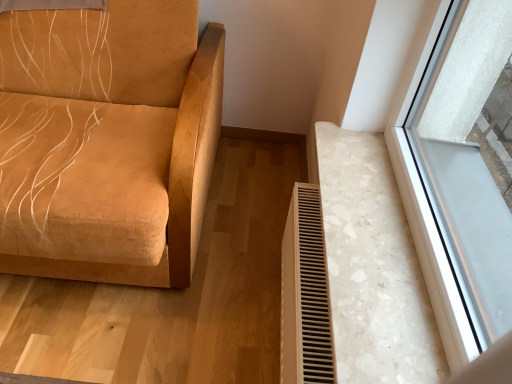
Question: Is white textured radiator at lower right situated inside suede-like tan sofa at left or outside?

Choices:
 (A) outside
 (B) inside

Answer: (A)

Question: Is white textured radiator at lower right in front of or behind suede-like tan sofa at left in the image?

Choices:
 (A) front
 (B) behind

Answer: (B)

Question: Considering the positions of white textured radiator at lower right and suede-like tan sofa at left in the image, is white textured radiator at lower right taller or shorter than suede-like tan sofa at left?

Choices:
 (A) short
 (B) tall

Answer: (A)

Question: Is suede-like tan sofa at left wider or thinner than white textured radiator at lower right?

Choices:
 (A) wide
 (B) thin

Answer: (A)

Question: Visually, is suede-like tan sofa at left positioned to the left or to the right of white textured radiator at lower right?

Choices:
 (A) right
 (B) left

Answer: (B)

Question: In the image, is suede-like tan sofa at left positioned in front of or behind white textured radiator at lower right?

Choices:
 (A) front
 (B) behind

Answer: (A)

Question: Is suede-like tan sofa at left situated inside white textured radiator at lower right or outside?

Choices:
 (A) inside
 (B) outside

Answer: (B)